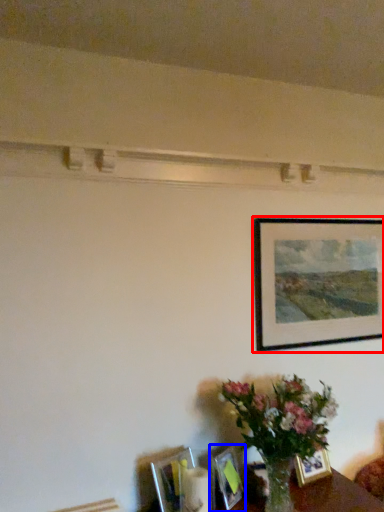
Question: Which of the following is the farthest to the observer, picture frame (highlighted by a red box) or picture frame (highlighted by a blue box)?

Choices:
 (A) picture frame
 (B) picture frame

Answer: (A)